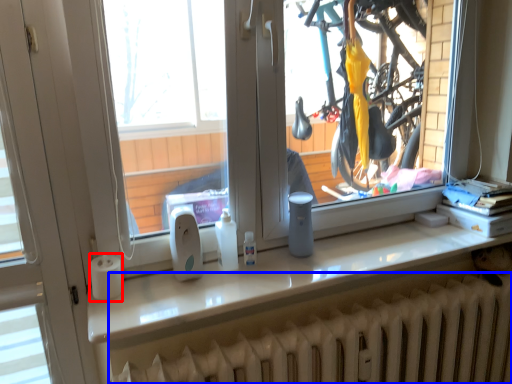
Question: Among these objects, which one is nearest to the camera, paper towel (highlighted by a red box) or radiator (highlighted by a blue box)?

Choices:
 (A) paper towel
 (B) radiator

Answer: (B)